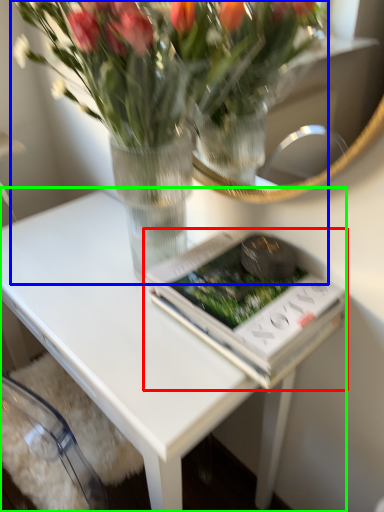
Question: Which object is positioned farthest from paperback book (highlighted by a red box)? Select from houseplant (highlighted by a blue box) and table (highlighted by a green box).

Choices:
 (A) houseplant
 (B) table

Answer: (A)